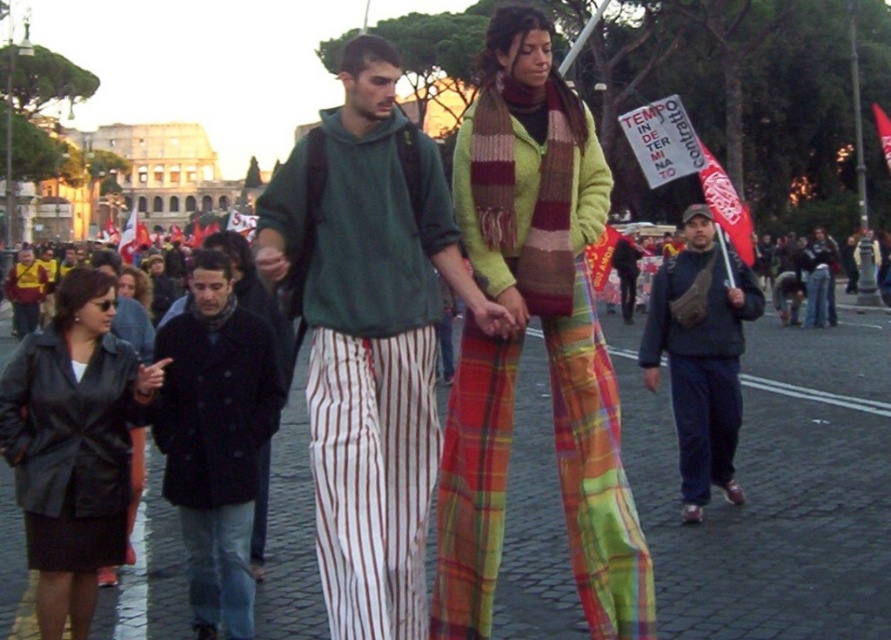
Question: Among these points, which one is nearest to the camera?

Choices:
 (A) (631, 544)
 (B) (732, 467)

Answer: (A)

Question: Considering the real-world distances, which object is farthest from the green fleece sweatshirt at center?

Choices:
 (A) knitted wool scarf at center
 (B) dark blue wool coat at center

Answer: (B)

Question: Is green fleece sweatshirt at center above dark blue jeans at center?

Choices:
 (A) no
 (B) yes

Answer: (A)

Question: Is green fleece sweatshirt at center wider than dark blue jeans at center?

Choices:
 (A) no
 (B) yes

Answer: (B)

Question: Which point appears closest to the camera in this image?

Choices:
 (A) (96, 490)
 (B) (683, 433)

Answer: (A)

Question: Does knitted wool scarf at center have a larger size compared to green fleece sweatshirt at center?

Choices:
 (A) yes
 (B) no

Answer: (B)